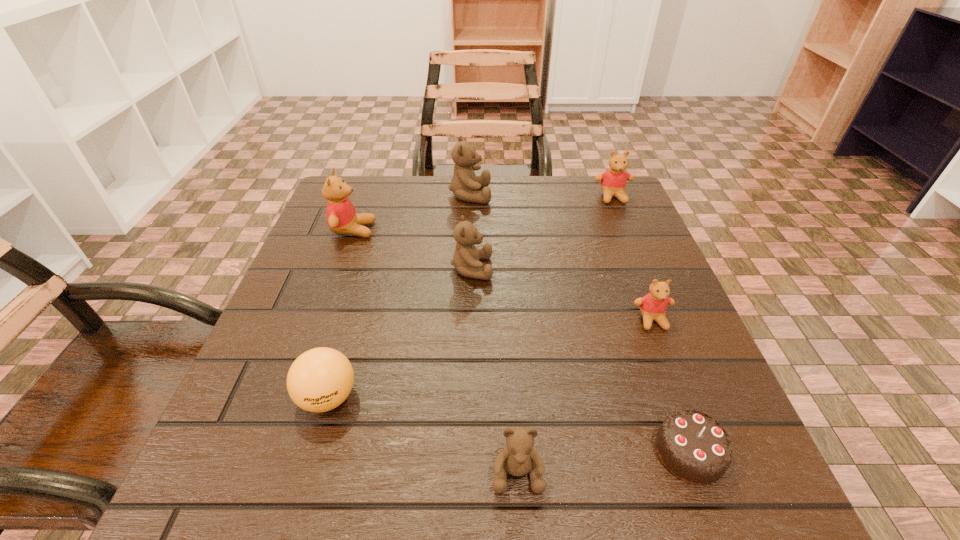
The height and width of the screenshot is (540, 960). In order to click on blank space at the left edge of the desktop in this screenshot , I will do (x=275, y=338).

The width and height of the screenshot is (960, 540). In order to click on vacant space at the right edge of the desktop in this screenshot , I will do `click(714, 411)`.

At what (x,y) coordinates should I click in order to perform the action: click on vacant space at the far left corner of the desktop. Please return your answer as a coordinate pair (x, y). Looking at the image, I should click on (368, 196).

I want to click on vacant space at the near left corner of the desktop, so click(x=248, y=456).

You are a GUI agent. You are given a task and a screenshot of the screen. Output one action in this format:
    pyautogui.click(x=<x>, y=<y>)
    Task: Click on the vacant space at the far right corner
    This screenshot has height=540, width=960.
    Given the screenshot: What is the action you would take?
    pyautogui.click(x=585, y=215)

Image resolution: width=960 pixels, height=540 pixels. I want to click on empty space between the fifth farthest object and the third nearest teddy bear, so click(x=562, y=294).

This screenshot has height=540, width=960. I want to click on vacant area that lies between the fourth farthest teddy bear and the nearest brown teddy bear, so click(x=494, y=370).

Locate an element on the screen. free space between the chocolate chocolate cake and the fifth farthest object is located at coordinates (671, 386).

Where is `free space between the biggest red teddy bear and the second nearest teddy bear`? The width and height of the screenshot is (960, 540). free space between the biggest red teddy bear and the second nearest teddy bear is located at coordinates (503, 275).

Locate an element on the screen. empty space between the second farthest red teddy bear and the nearest brown teddy bear is located at coordinates (436, 351).